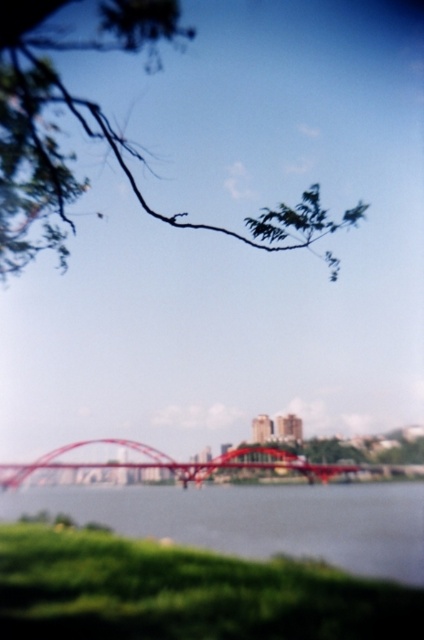
Question: Which of the following is the farthest from the observer?

Choices:
 (A) metallic red bridge at center
 (B) green grass at lower center
 (C) green leafy branch at upper left

Answer: (A)

Question: Is green leafy branch at upper left smaller than green grass at lower center?

Choices:
 (A) yes
 (B) no

Answer: (B)

Question: Does green leafy branch at upper left have a larger size compared to green grass at lower center?

Choices:
 (A) no
 (B) yes

Answer: (B)

Question: Estimate the real-world distances between objects in this image. Which object is farther from the green leafy branch at upper left?

Choices:
 (A) metallic red bridge at center
 (B) green grass at lower center

Answer: (A)

Question: Considering the relative positions of green leafy branch at upper left and metallic red bridge at center in the image provided, where is green leafy branch at upper left located with respect to metallic red bridge at center?

Choices:
 (A) above
 (B) below

Answer: (A)

Question: Which point is closer to the camera?

Choices:
 (A) green grass at lower center
 (B) green leafy branch at upper left

Answer: (B)